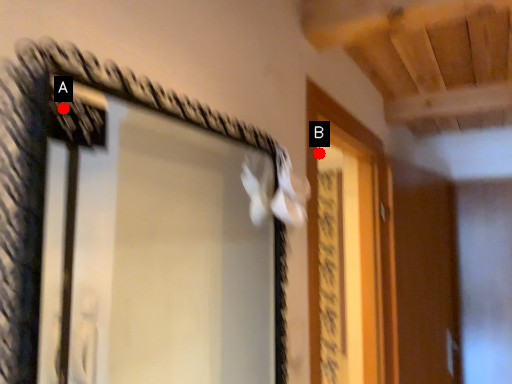
Question: Two points are circled on the image, labeled by A and B beside each circle. Which of the following is the closest to the observer?

Choices:
 (A) A is closer
 (B) B is closer

Answer: (A)